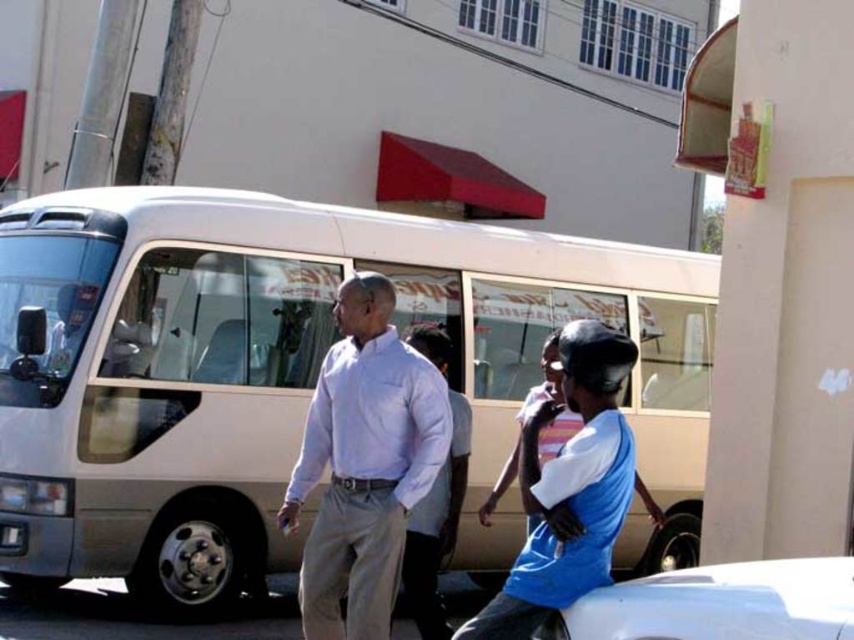
Question: In this image, where is white cotton shirt at center located relative to white glossy car at lower right?

Choices:
 (A) right
 (B) left

Answer: (B)

Question: Which is nearer to the blue fabric shirt at center?

Choices:
 (A) white glossy car at lower right
 (B) beige matte bus at center

Answer: (A)

Question: Which point is closer to the camera?

Choices:
 (A) white glossy car at lower right
 (B) blue fabric shirt at center
 (C) white cotton shirt at center
 (D) beige matte bus at center

Answer: (A)

Question: Does white cotton shirt at center appear on the left side of blue fabric shirt at center?

Choices:
 (A) yes
 (B) no

Answer: (A)

Question: Does beige matte bus at center have a greater width compared to white cotton shirt at center?

Choices:
 (A) yes
 (B) no

Answer: (B)

Question: Which of the following is the farthest from the observer?

Choices:
 (A) blue fabric shirt at center
 (B) beige matte bus at center
 (C) white glossy car at lower right
 (D) white cotton shirt at center

Answer: (B)